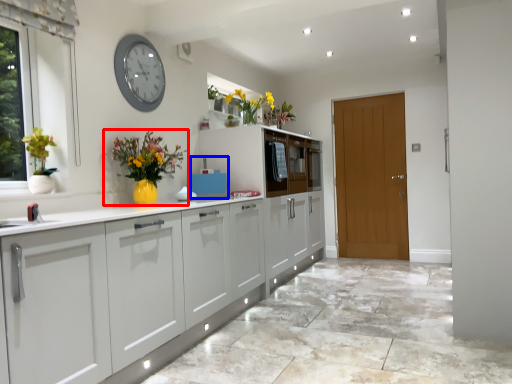
Question: Among these objects, which one is nearest to the camera, houseplant (highlighted by a red box) or appliance (highlighted by a blue box)?

Choices:
 (A) houseplant
 (B) appliance

Answer: (A)